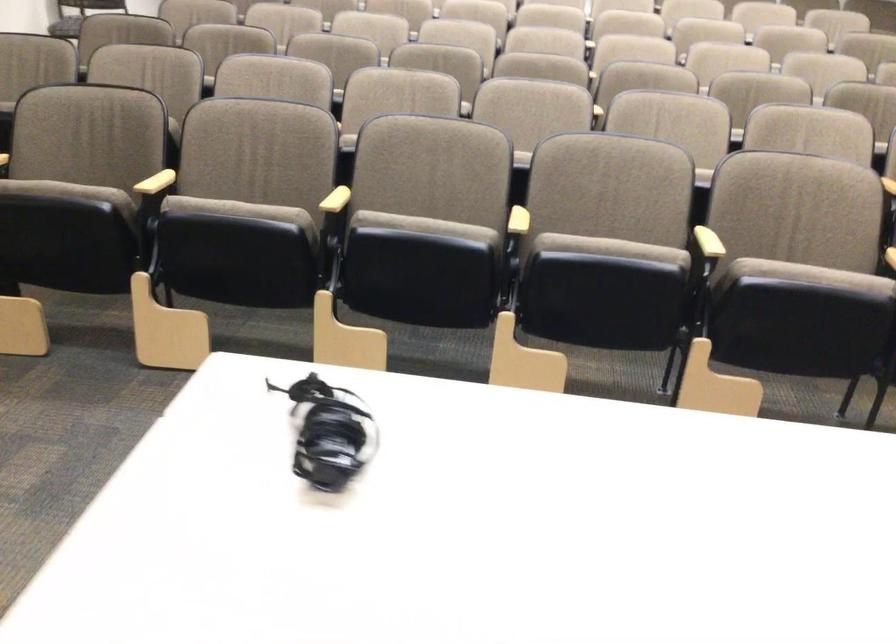
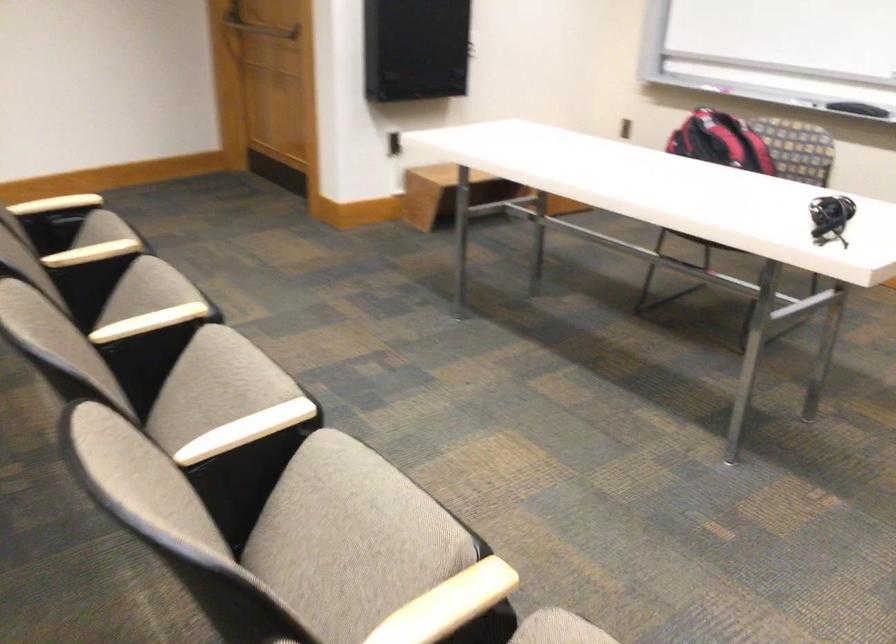
The point at (800, 275) is marked in the first image. Where is the corresponding point in the second image?

(147, 290)